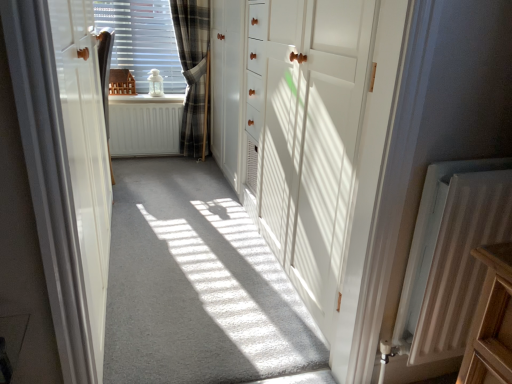
Question: Would you say satin brown curtain at center, the second curtain when ordered from right to left, is to the left or to the right of white wood door at center, the first door viewed from the right, in the picture?

Choices:
 (A) right
 (B) left

Answer: (B)

Question: Is point (108, 140) positioned closer to the camera than point (366, 157)?

Choices:
 (A) farther
 (B) closer

Answer: (A)

Question: Which object is positioned closest to the white matte radiator at center, the 2th radiator when ordered from front to back?

Choices:
 (A) white textured radiator at lower right, which appears as the first radiator when viewed from the front
 (B) white glossy door at left, the 1th door from the left
 (C) satin brown curtain at center, positioned as the 1th curtain in left-to-right order
 (D) white wood door at center, the first door viewed from the right
 (E) white carpet at center

Answer: (C)

Question: Estimate the real-world distances between objects in this image. Which object is closer to the satin brown curtain at center, the second curtain in the back-to-front sequence?

Choices:
 (A) white wood door at center, the 2th door from the left
 (B) white matte radiator at center, the 2th radiator in the right-to-left sequence
 (C) translucent plastic window at center
 (D) white glossy door at left, positioned as the second door in right-to-left order
 (E) white textured radiator at lower right, which is the 2th radiator in back-to-front order

Answer: (C)